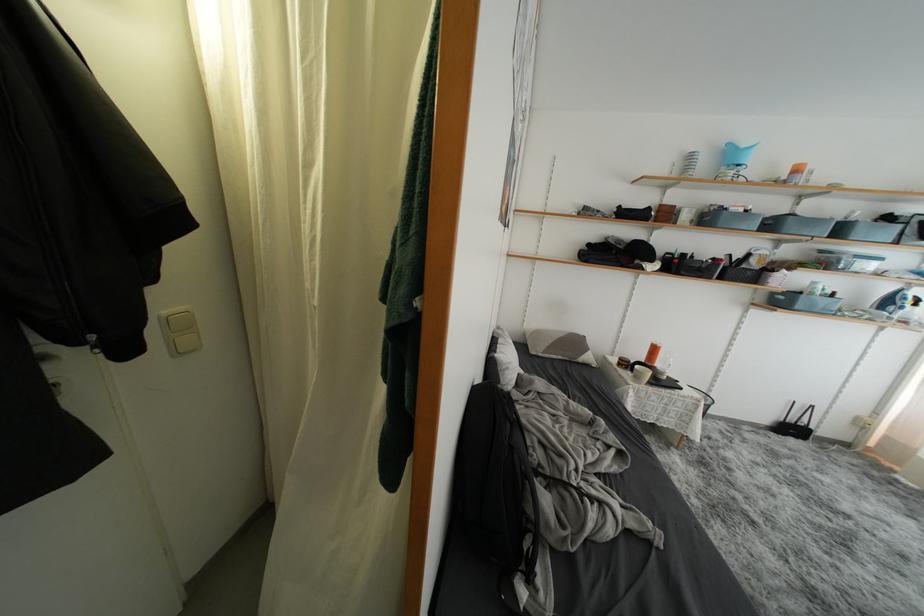
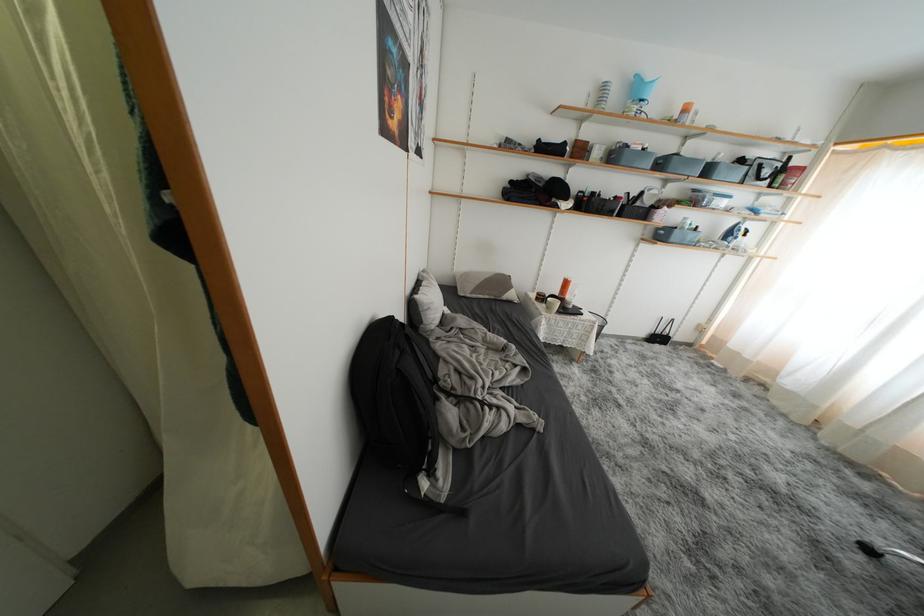
The point at (582,346) is marked in the first image. Where is the corresponding point in the second image?

(508, 286)